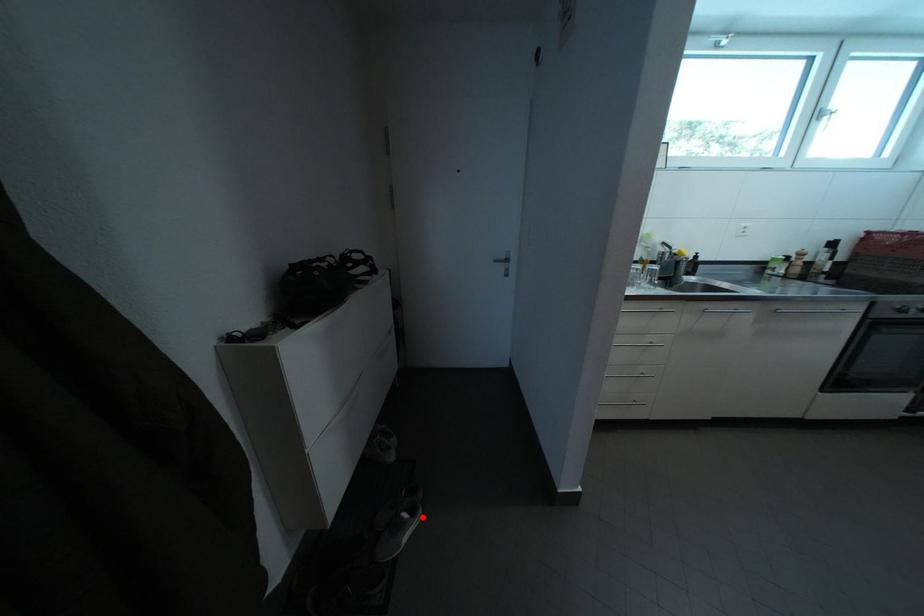
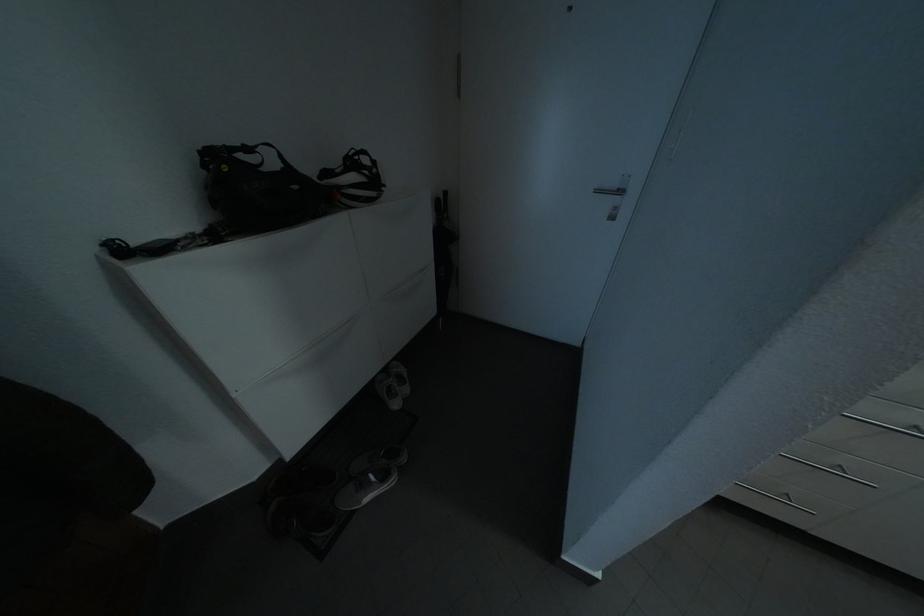
In the second image, find the point that corresponds to the highlighted location in the first image.

(393, 483)